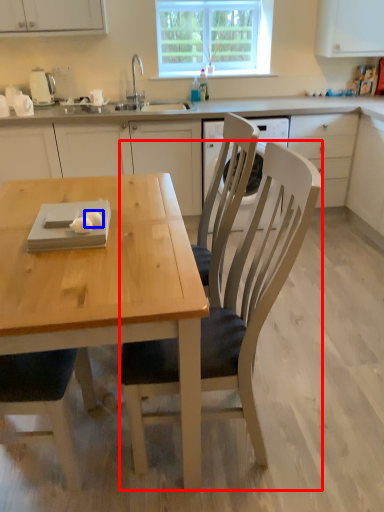
Question: Which object is further to the camera taking this photo, chair (highlighted by a red box) or food (highlighted by a blue box)?

Choices:
 (A) chair
 (B) food

Answer: (B)